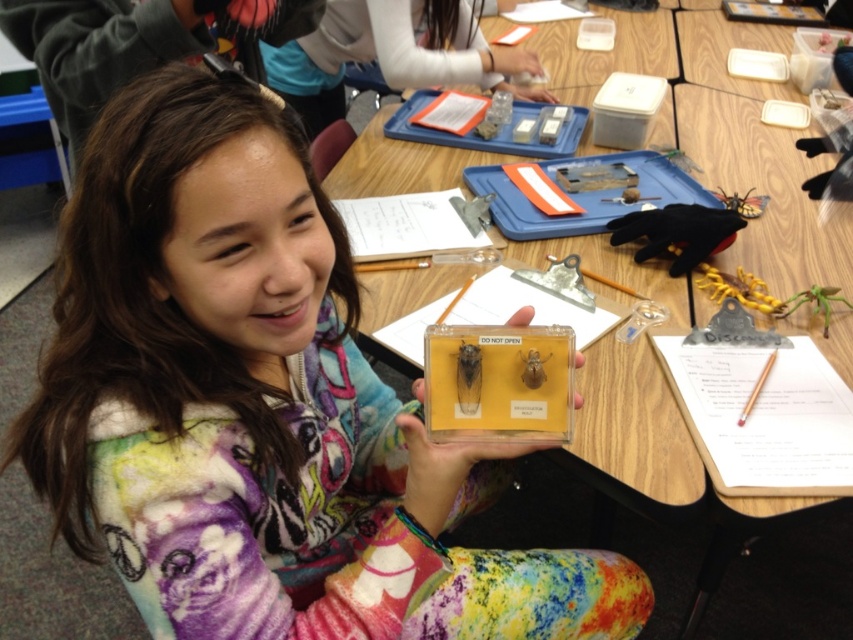
Question: Which object is the closest to the matte plastic tray at upper center?

Choices:
 (A) clear plastic containers at upper right
 (B) translucent plastic container at upper center
 (C) translucent plastic container at center

Answer: (B)

Question: Which point appears closest to the camera in this image?

Choices:
 (A) (364, 10)
 (B) (712, 77)
 (C) (248, 436)
 (D) (619, 51)

Answer: (C)

Question: Which of the following is the closest to the observer?

Choices:
 (A) translucent plastic container at upper center
 (B) translucent plastic container at center
 (C) clear plastic containers at upper right
 (D) matte plastic tray at upper center

Answer: (B)

Question: Is the position of clear plastic tray at center less distant than that of translucent plastic container at upper center?

Choices:
 (A) no
 (B) yes

Answer: (B)

Question: Is clear plastic tray at center smaller than clear plastic containers at upper right?

Choices:
 (A) no
 (B) yes

Answer: (A)

Question: Does translucent plastic container at center appear over clear plastic tray at center?

Choices:
 (A) no
 (B) yes

Answer: (A)